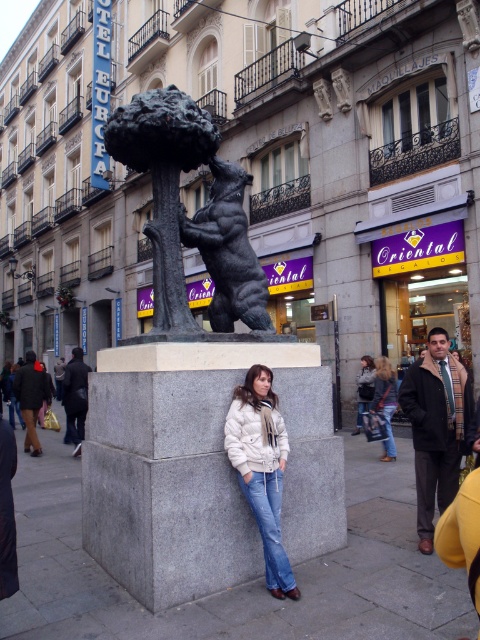
Question: Considering the relative positions of black polished stone bear at center and denim jacket at lower right in the image provided, where is black polished stone bear at center located with respect to denim jacket at lower right?

Choices:
 (A) right
 (B) left

Answer: (B)

Question: Which point is closer to the camera?

Choices:
 (A) (169, 240)
 (B) (238, 276)
 (C) (428, 508)

Answer: (A)

Question: Is bronze bear at center to the left of black polished stone bear at center from the viewer's perspective?

Choices:
 (A) yes
 (B) no

Answer: (A)

Question: Does dark brown leather jacket at lower right lie in front of denim jacket at lower right?

Choices:
 (A) yes
 (B) no

Answer: (A)

Question: Considering the real-world distances, which object is farthest from the denim jacket at lower right?

Choices:
 (A) dark brown leather jacket at lower right
 (B) black polished stone bear at center
 (C) white puffy jacket at center
 (D) bronze bear at center

Answer: (C)

Question: Among these objects, which one is farthest from the camera?

Choices:
 (A) bronze bear at center
 (B) white puffy jacket at center
 (C) denim jacket at lower right

Answer: (C)